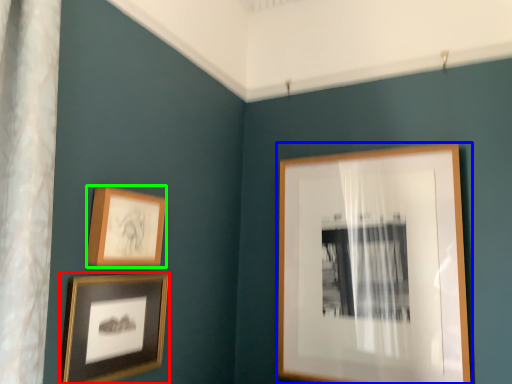
Question: Considering the real-world distances, which object is closest to picture frame (highlighted by a red box)? picture frame (highlighted by a blue box) or picture frame (highlighted by a green box).

Choices:
 (A) picture frame
 (B) picture frame

Answer: (B)